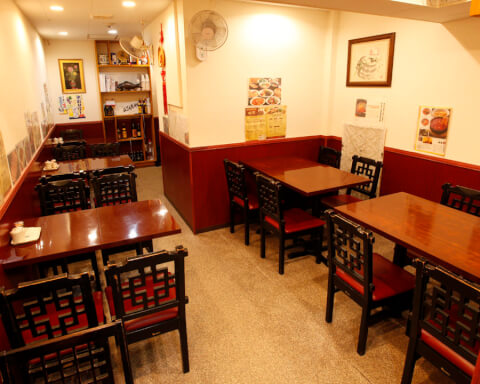
Image resolution: width=480 pixels, height=384 pixels. I want to click on fan, so click(x=206, y=26).